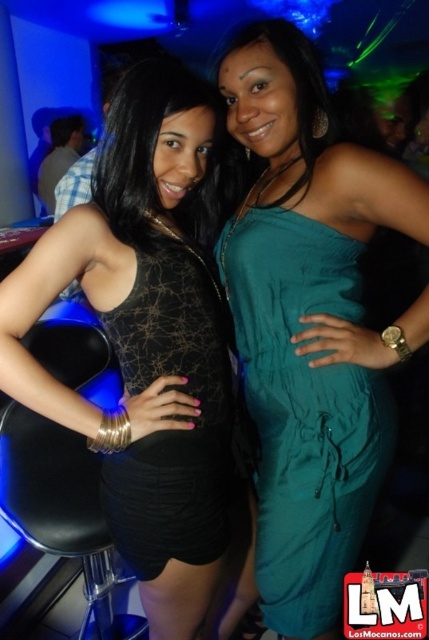
Question: Is teal fabric jumpsuit at center below black mesh dress at center?

Choices:
 (A) no
 (B) yes

Answer: (A)

Question: Is teal fabric jumpsuit at center to the right of black mesh dress at center from the viewer's perspective?

Choices:
 (A) no
 (B) yes

Answer: (B)

Question: Among these points, which one is nearest to the camera?

Choices:
 (A) (166, 339)
 (B) (268, 516)
 (C) (192, 200)

Answer: (A)

Question: Considering the real-world distances, which object is farthest from the matte black dress at center?

Choices:
 (A) black mesh dress at center
 (B) teal fabric jumpsuit at center

Answer: (B)

Question: Which point is closer to the camera?

Choices:
 (A) (x=184, y=476)
 (B) (x=380, y=164)
 (C) (x=138, y=285)

Answer: (B)

Question: Can you confirm if matte black dress at center is wider than black mesh dress at center?

Choices:
 (A) yes
 (B) no

Answer: (A)